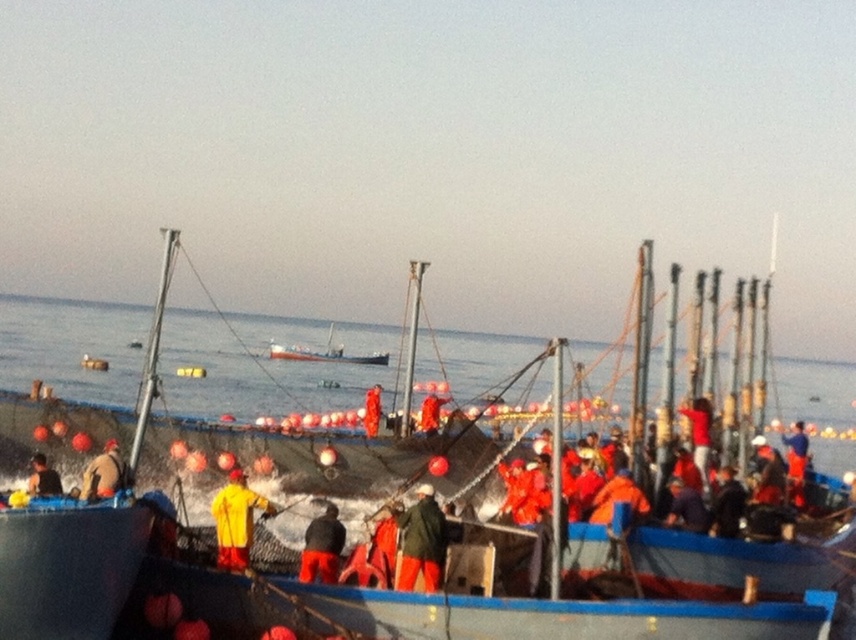
You are a photographer on a nearby boat and want to capture both the blue plastic boat at center and the green fabric jacket at center in the same frame. Given that your camera has a fixed focal length, which object should you focus on first to ensure both are in focus?

Since the blue plastic boat at center is larger in size than the green fabric jacket at center, you should focus on the blue plastic boat at center first to ensure both are in focus.

From the picture: You are a sailor on the blue plastic boat at center and need to move the dark gray fabric jacket at center to the other side of the boat. Can you do this without the jacket falling into the water?

The blue plastic boat at center is wider than the dark gray fabric jacket at center, so yes, you can move the dark gray fabric jacket at center to the other side of the boat without it falling into the water.

Looking at this image, you are standing on the deck of a ship observing the scene. There is a blue plastic boat at center and a dark gray fabric jacket at center. Which object is positioned more to the right side of the scene?

The blue plastic boat at center is positioned to the right of the dark gray fabric jacket at center, so the blue plastic boat at center is more to the right.